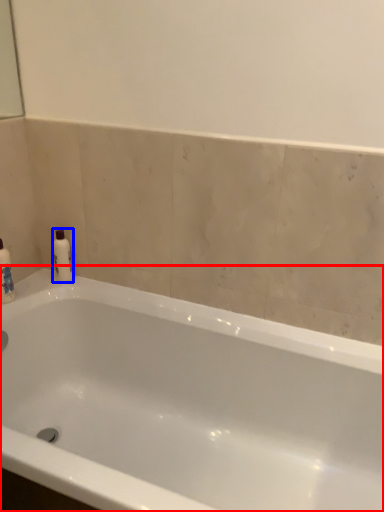
Question: Among these objects, which one is nearest to the camera, bathtub (highlighted by a red box) or mouthwash (highlighted by a blue box)?

Choices:
 (A) bathtub
 (B) mouthwash

Answer: (A)